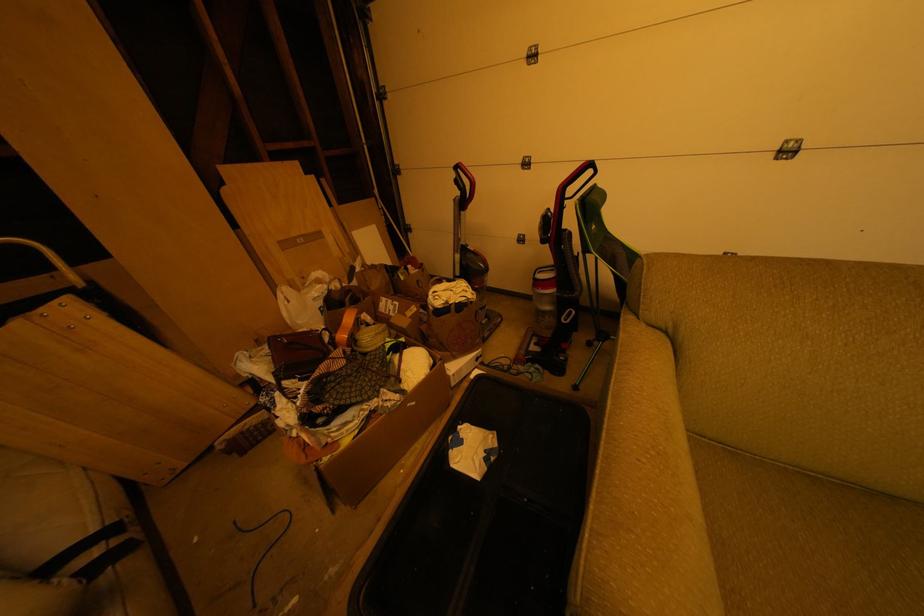
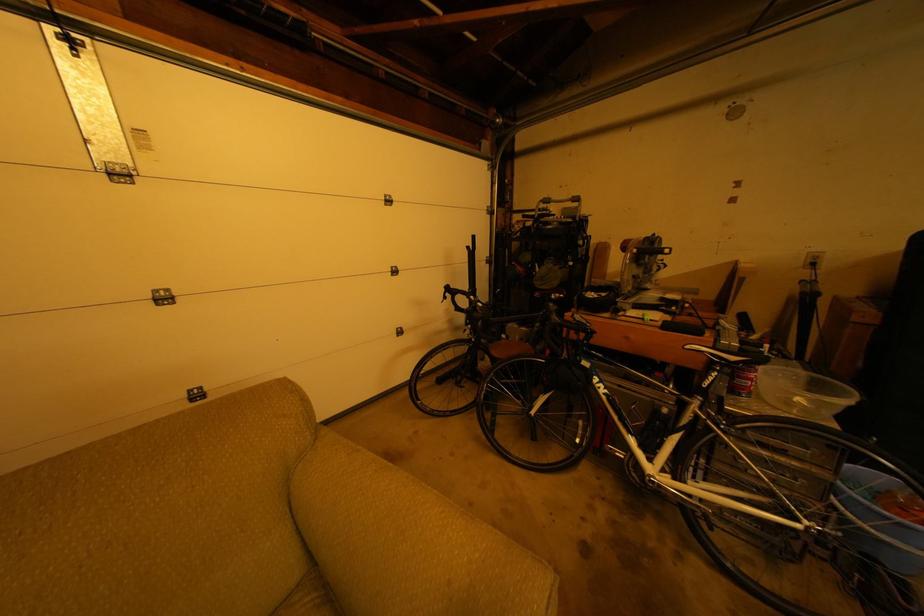
Question: The images are taken continuously from a first-person perspective. In which direction is your viewpoint rotating?

Choices:
 (A) Left
 (B) Right
 (C) Up
 (D) Down

Answer: (B)